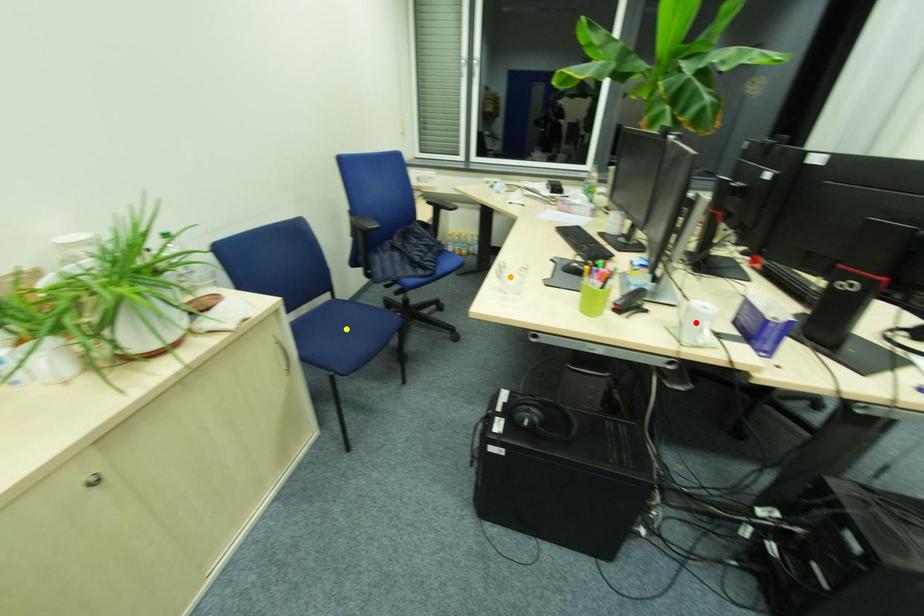
Order these from farthest to nearest:
yellow point | red point | orange point

yellow point → orange point → red point